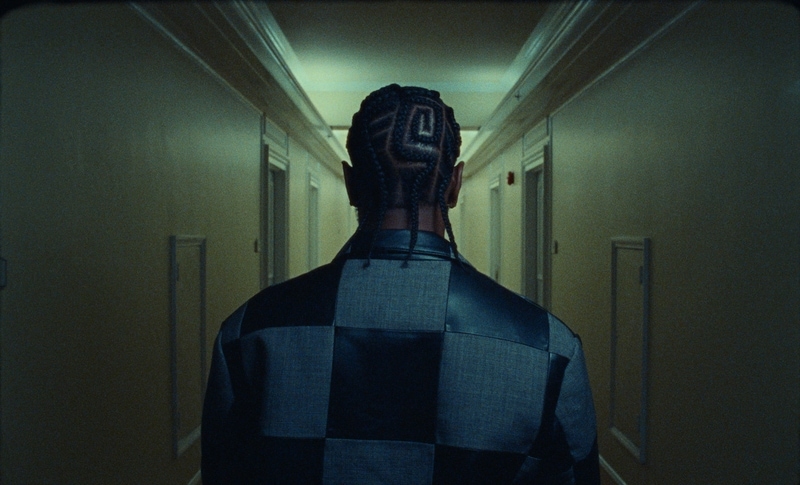
At what (x,y) coordinates should I click in order to perform the action: click on closed doors. Please return your answer as a coordinate pair (x, y). Looking at the image, I should click on (274, 210), (313, 217), (494, 221), (542, 209).